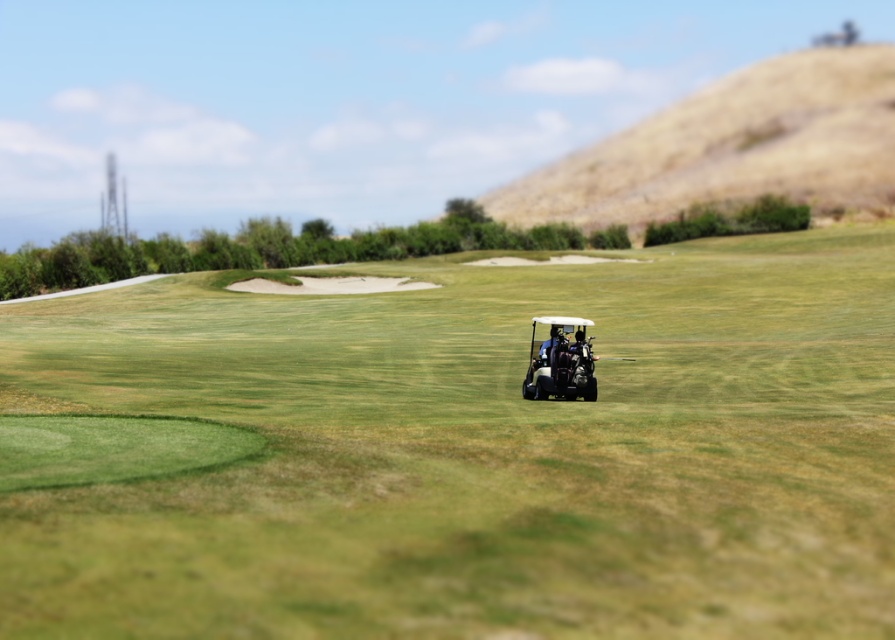
Can you confirm if dried grass hill at upper right is taller than matte black golf cart at center?

Correct, dried grass hill at upper right is much taller as matte black golf cart at center.

Is point (851, 56) farther from camera compared to point (535, 368)?

Yes.

Does point (526, 189) come in front of point (534, 369)?

No, (526, 189) is further to viewer.

At what (x,y) coordinates should I click in order to perform the action: click on dried grass hill at upper right. Please return your answer as a coordinate pair (x, y). This screenshot has height=640, width=895. Looking at the image, I should click on (732, 147).

Can you confirm if white plastic golf cart at center is positioned below dried grass hill at upper right?

Correct, white plastic golf cart at center is located below dried grass hill at upper right.

Is white plastic golf cart at center to the right of dried grass hill at upper right from the viewer's perspective?

No, white plastic golf cart at center is not to the right of dried grass hill at upper right.

Is point (371, 326) behind point (832, 81)?

No.

Identify the location of white plastic golf cart at center. (482, 452).

Is white plastic golf cart at center to the left of matte black golf cart at center from the viewer's perspective?

Correct, you'll find white plastic golf cart at center to the left of matte black golf cart at center.

Consider the image. Does white plastic golf cart at center appear over matte black golf cart at center?

Yes, white plastic golf cart at center is above matte black golf cart at center.

Who is more forward, (655,340) or (582,340)?

Point (582,340) is in front.

I want to click on white plastic golf cart at center, so click(x=482, y=452).